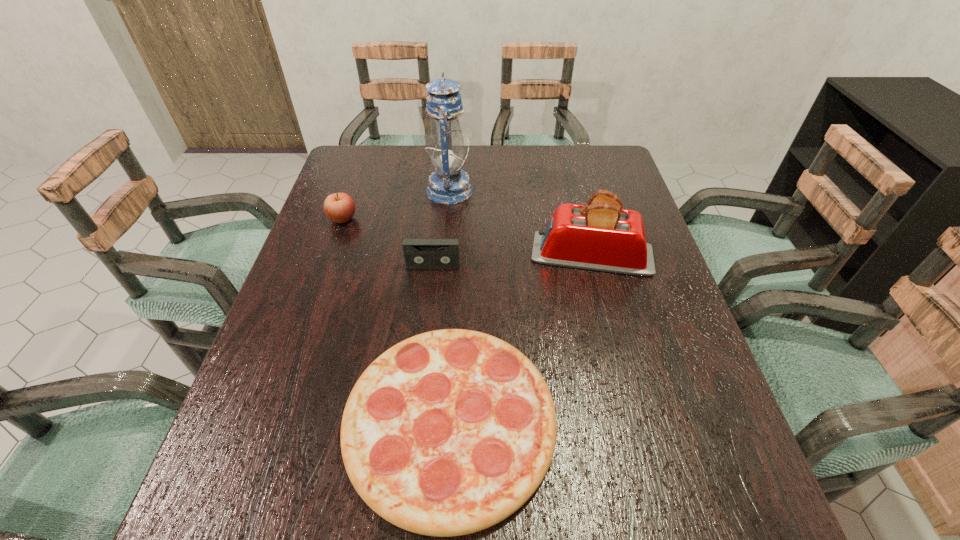
Locate an element on the screen. Image resolution: width=960 pixels, height=540 pixels. object that can be found as the closest to the pizza is located at coordinates click(x=601, y=236).

Select which object appears as the closest to the leftmost object. Please provide its 2D coordinates. Your answer should be formatted as a tuple, i.e. [(x, y)], where the tuple contains the x and y coordinates of a point satisfying the conditions above.

[(448, 185)]

The image size is (960, 540). I want to click on free space that satisfies the following two spatial constraints: 1. on the back side of the toaster; 2. on the front-facing side of the farthest object, so click(x=575, y=191).

Identify the location of free location that satisfies the following two spatial constraints: 1. on the front-facing side of the fourth shortest object; 2. on the left side of the tallest object. The image size is (960, 540). (444, 254).

You are a GUI agent. You are given a task and a screenshot of the screen. Output one action in this format:
    pyautogui.click(x=<x>, y=<y>)
    Task: Click on the vacant space that satisfies the following two spatial constraints: 1. on the front-facing side of the nearest object; 2. on the right side of the videotape
    The image size is (960, 540).
    Given the screenshot: What is the action you would take?
    (417, 421)

At what (x,y) coordinates should I click in order to perform the action: click on free space in the image that satisfies the following two spatial constraints: 1. on the front-facing side of the pizza; 2. on the right side of the farthest object. Please return your answer as a coordinate pair (x, y). This screenshot has width=960, height=540. Looking at the image, I should click on (431, 421).

You are a GUI agent. You are given a task and a screenshot of the screen. Output one action in this format:
    pyautogui.click(x=<x>, y=<y>)
    Task: Click on the vacant position in the image that satisfies the following two spatial constraints: 1. on the back side of the toaster; 2. on the left side of the pizza
    
    Given the screenshot: What is the action you would take?
    pyautogui.click(x=459, y=254)

Identify the location of vacant space that satisfies the following two spatial constraints: 1. on the back side of the shortest object; 2. on the left side of the second tallest object. (459, 254).